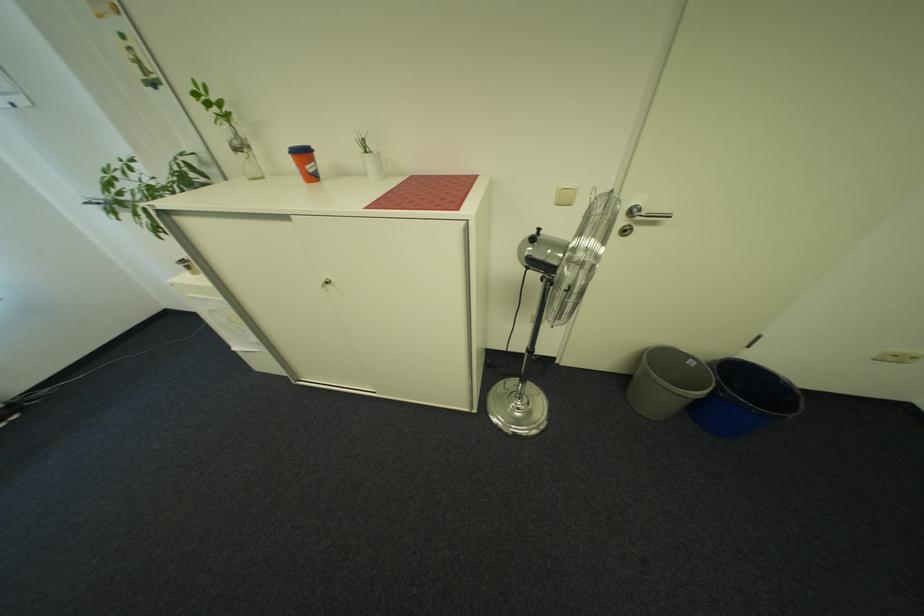
The width and height of the screenshot is (924, 616). In order to click on small white cup in this screenshot , I will do `click(373, 166)`.